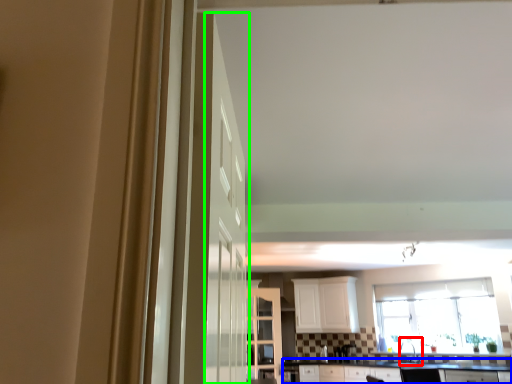
Question: Which is nearer to the sink (highlighted by a red box)? countertop (highlighted by a blue box) or door (highlighted by a green box).

Choices:
 (A) countertop
 (B) door

Answer: (A)